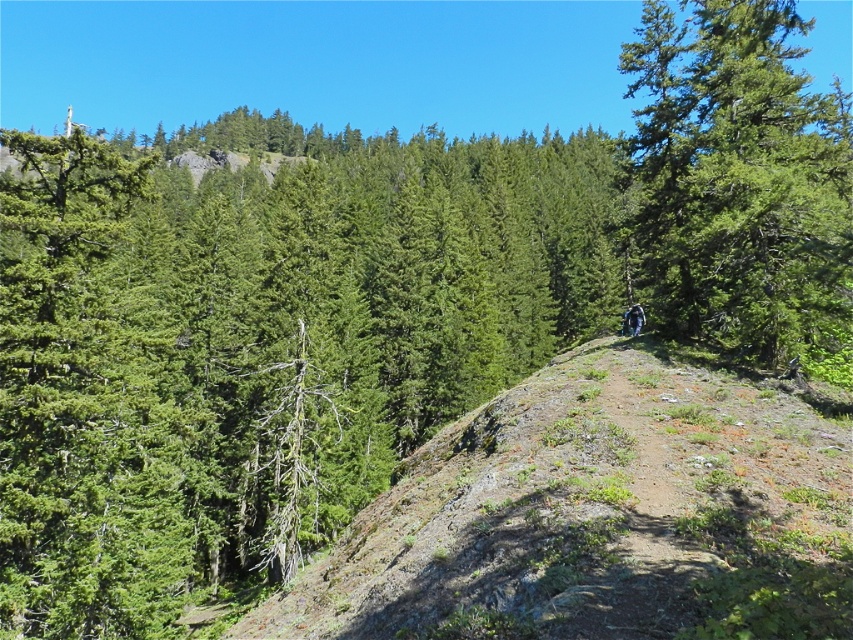
You are a hiker looking at the scene and want to know if the dull brown dirt at center is visible from your current position. Can you see it through the green textured tree at center?

The dull brown dirt at center is in front of the green textured tree at center, so yes, you can see the dull brown dirt at center because it is positioned in front of the tree.

You are a hiker standing at the bottom of the hill. You see a green textured tree at upper center and dull brown dirt at center. Which object is higher up the hill?

The green textured tree at upper center is taller than the dull brown dirt at center, so it is higher up the hill.